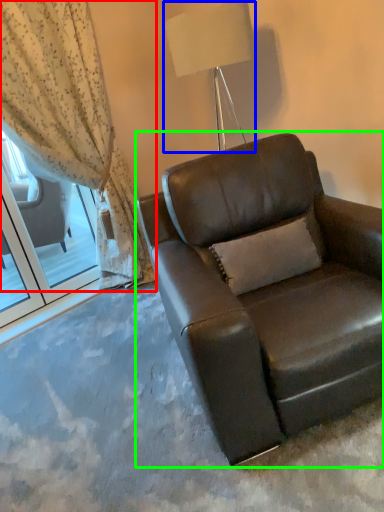
Question: Which object is the closest to the curtain (highlighted by a red box)? Choose among these: lamp (highlighted by a blue box) or chair (highlighted by a green box).

Choices:
 (A) lamp
 (B) chair

Answer: (A)